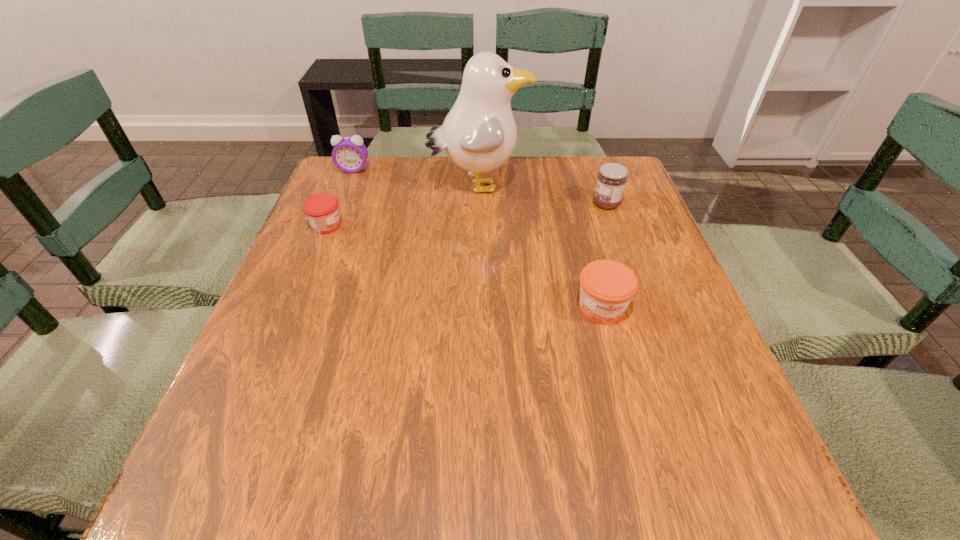
Identify the location of vacant space located on the front label of the farthest jam. This screenshot has width=960, height=540. (476, 204).

You are a GUI agent. You are given a task and a screenshot of the screen. Output one action in this format:
    pyautogui.click(x=<x>, y=<y>)
    Task: Click on the free spot located on the front label of the farthest jam
    The height and width of the screenshot is (540, 960).
    Given the screenshot: What is the action you would take?
    pyautogui.click(x=468, y=204)

The width and height of the screenshot is (960, 540). I want to click on free space located 0.290m on the front label of the nearest jam, so click(x=648, y=487).

This screenshot has height=540, width=960. What are the coordinates of `free point located 0.190m on the label side of the second nearest object` in the screenshot? It's located at (421, 226).

Locate an element on the screen. Image resolution: width=960 pixels, height=540 pixels. gull situated at the far edge is located at coordinates (479, 134).

Find the location of `alarm clock present at the far edge`. alarm clock present at the far edge is located at coordinates (350, 154).

Find the location of `jam that is at the far edge`. jam that is at the far edge is located at coordinates (x=611, y=180).

Locate an element on the screen. This screenshot has width=960, height=540. alarm clock that is at the left edge is located at coordinates (350, 154).

The height and width of the screenshot is (540, 960). In order to click on jam located at the left edge in this screenshot , I will do `click(322, 210)`.

The height and width of the screenshot is (540, 960). What are the coordinates of `object at the far left corner` in the screenshot? It's located at (x=350, y=154).